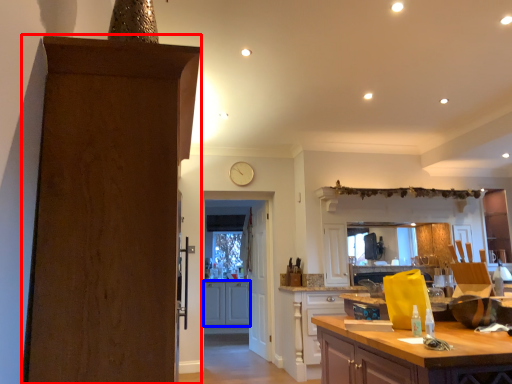
Question: Among these objects, which one is nearest to the camera, door (highlighted by a red box) or cabinetry (highlighted by a blue box)?

Choices:
 (A) door
 (B) cabinetry

Answer: (A)